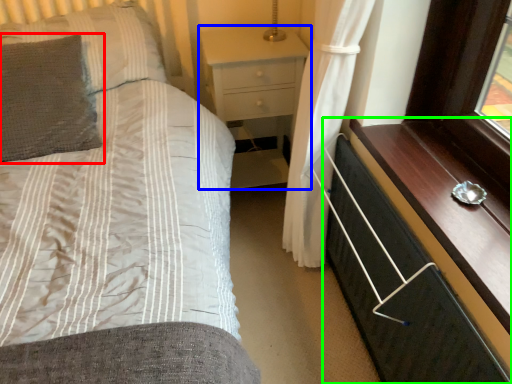
Question: Estimate the real-world distances between objects in this image. Which object is closer to pillow (highlighted by a red box), nightstand (highlighted by a blue box) or chest of drawers (highlighted by a green box)?

Choices:
 (A) nightstand
 (B) chest of drawers

Answer: (A)